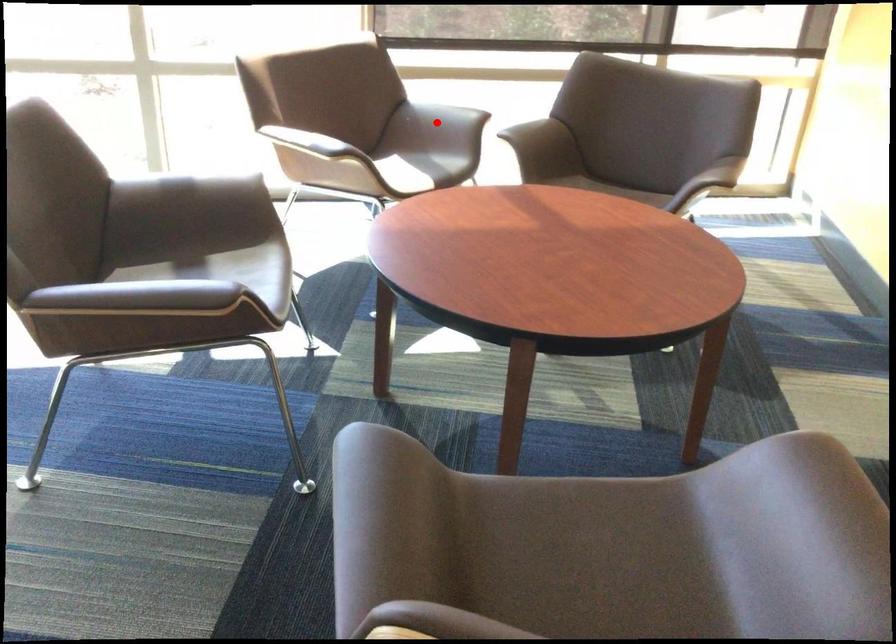
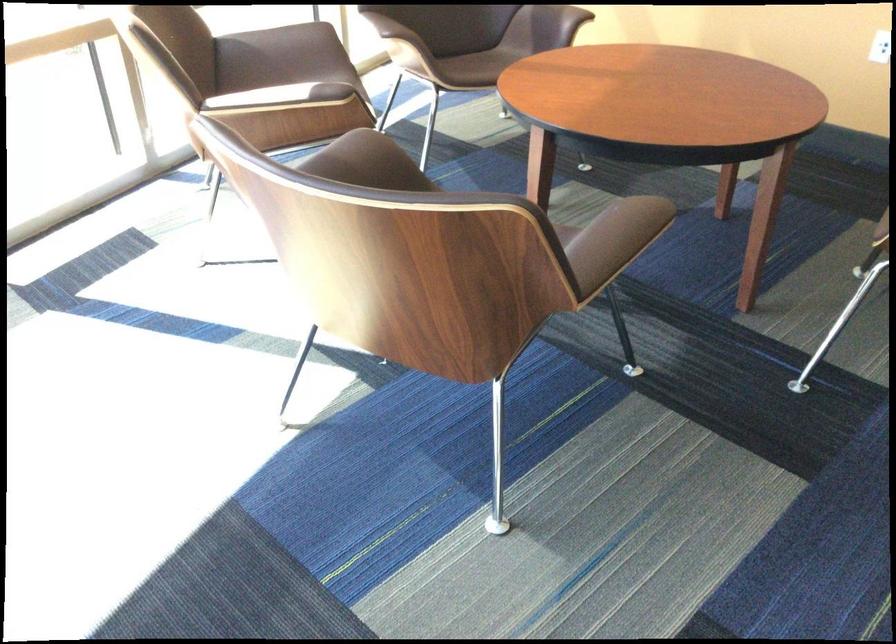
Find the pixel in the second image that matches the highlighted location in the first image.

(281, 55)